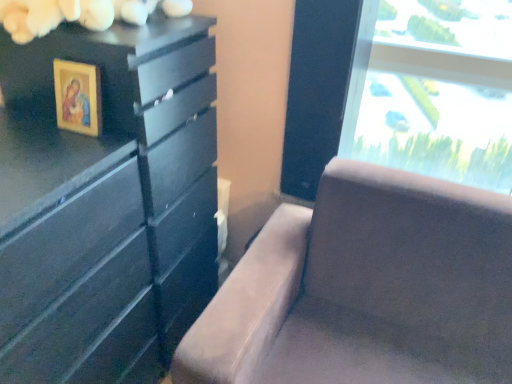
The width and height of the screenshot is (512, 384). I want to click on suede-like brown couch at center, so click(366, 289).

Identify the location of wooden framed picture at upper left. click(78, 97).

What is the approximate width of wooden framed picture at upper left?

The width of wooden framed picture at upper left is 1.76 inches.

The height and width of the screenshot is (384, 512). I want to click on matte black dresser at left, so click(106, 204).

From the image's perspective, is suede-like brown couch at center above or below matte black dresser at left?

suede-like brown couch at center is below matte black dresser at left.

From a real-world perspective, is suede-like brown couch at center below matte black dresser at left?

Yes, from a real-world perspective, suede-like brown couch at center is below matte black dresser at left.

From their relative heights in the image, would you say suede-like brown couch at center is taller or shorter than matte black dresser at left?

Clearly, suede-like brown couch at center is shorter compared to matte black dresser at left.

Can you see suede-like brown couch at center touching matte black dresser at left?

suede-like brown couch at center and matte black dresser at left are clearly separated.

From a real-world perspective, between matte black dresser at left and wooden framed picture at upper left, who is vertically higher?

From a 3D spatial view, wooden framed picture at upper left is above.

Does matte black dresser at left have a greater width compared to wooden framed picture at upper left?

Yes, matte black dresser at left is wider than wooden framed picture at upper left.

From the image's perspective, does matte black dresser at left appear lower than wooden framed picture at upper left?

Yes, from the image's perspective, matte black dresser at left is beneath wooden framed picture at upper left.

This screenshot has height=384, width=512. Find the location of `picture frame on the left of matte black dresser at left`. picture frame on the left of matte black dresser at left is located at coordinates (78, 97).

From the image's perspective, is matte black dresser at left located beneath suede-like brown couch at center?

No.

Considering the positions of objects matte black dresser at left and suede-like brown couch at center in the image provided, who is in front, matte black dresser at left or suede-like brown couch at center?

suede-like brown couch at center.

In order to click on furniture that appears on the right of matte black dresser at left in this screenshot , I will do `click(366, 289)`.

Between point (62, 120) and point (377, 294), which one is positioned in front?

The point (62, 120) is more forward.

Is wooden framed picture at upper left oriented away from suede-like brown couch at center?

No.

From a real-world perspective, is wooden framed picture at upper left physically located above or below suede-like brown couch at center?

In terms of real-world spatial position, wooden framed picture at upper left is above suede-like brown couch at center.

Between wooden framed picture at upper left and suede-like brown couch at center, which one has less height?

Standing shorter between the two is wooden framed picture at upper left.

Which object is further away from the camera taking this photo, suede-like brown couch at center or wooden framed picture at upper left?

wooden framed picture at upper left.

There is a suede-like brown couch at center. Where is `picture frame above it (from a real-world perspective)`? picture frame above it (from a real-world perspective) is located at coordinates (78, 97).

Is suede-like brown couch at center located outside wooden framed picture at upper left?

Yes, suede-like brown couch at center is outside of wooden framed picture at upper left.

How different are the orientations of suede-like brown couch at center and wooden framed picture at upper left in degrees?

There is a 3.64-degree angle between the facing directions of suede-like brown couch at center and wooden framed picture at upper left.

Looking at this image, does wooden framed picture at upper left have a larger size compared to matte black dresser at left?

No, wooden framed picture at upper left is not bigger than matte black dresser at left.

From their relative heights in the image, would you say wooden framed picture at upper left is taller or shorter than matte black dresser at left?

wooden framed picture at upper left is shorter than matte black dresser at left.

Is wooden framed picture at upper left not close to matte black dresser at left?

They are positioned close to each other.

Which object is wider, wooden framed picture at upper left or matte black dresser at left?

With larger width is matte black dresser at left.

Locate an element on the screen. The height and width of the screenshot is (384, 512). furniture that appears on the right of matte black dresser at left is located at coordinates (366, 289).

I want to click on chest of drawers in front of the wooden framed picture at upper left, so click(x=106, y=204).

In the scene shown: Based on their spatial positions, is wooden framed picture at upper left or suede-like brown couch at center closer to matte black dresser at left?

wooden framed picture at upper left is positioned closer to the anchor matte black dresser at left.

Which object lies nearer to the anchor point wooden framed picture at upper left, suede-like brown couch at center or matte black dresser at left?

matte black dresser at left is positioned closer to the anchor wooden framed picture at upper left.

Estimate the real-world distances between objects in this image. Which object is closer to matte black dresser at left, suede-like brown couch at center or wooden framed picture at upper left?

wooden framed picture at upper left is closer to matte black dresser at left.

When comparing their distances from suede-like brown couch at center, does wooden framed picture at upper left or matte black dresser at left seem closer?

matte black dresser at left lies closer to suede-like brown couch at center than the other object.

Considering their positions, is matte black dresser at left positioned further to wooden framed picture at upper left than suede-like brown couch at center?

The object further to wooden framed picture at upper left is suede-like brown couch at center.

Looking at the image, which one is located closer to suede-like brown couch at center, matte black dresser at left or wooden framed picture at upper left?

matte black dresser at left is closer to suede-like brown couch at center.

Find the location of a particular element. chest of drawers between wooden framed picture at upper left and suede-like brown couch at center from left to right is located at coordinates (106, 204).